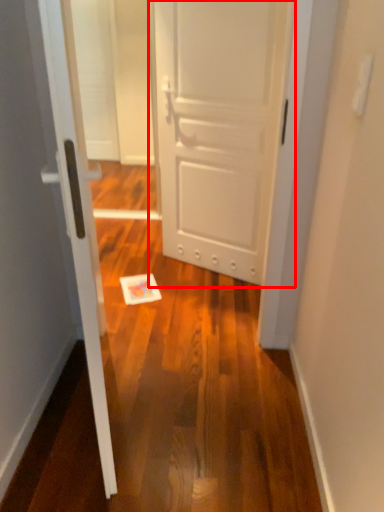
Question: From the image's perspective, what is the correct spatial relationship of door (annotated by the red box) in relation to door?

Choices:
 (A) above
 (B) below

Answer: (A)